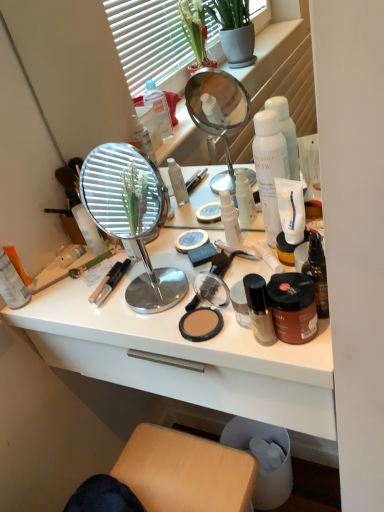
Locate an element on the screen. free location in front of matte black brush at lower left is located at coordinates (84, 305).